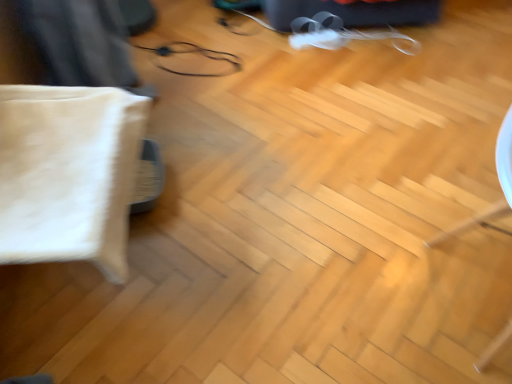
What is the approximate height of metallic wire at center?

2.73 inches.

The height and width of the screenshot is (384, 512). Describe the element at coordinates (192, 53) in the screenshot. I see `metallic wire at center` at that location.

Measure the distance between metallic wire at center and camera.

A distance of 1.91 meters exists between metallic wire at center and camera.

The height and width of the screenshot is (384, 512). I want to click on metallic wire at center, so click(x=192, y=53).

In order to click on white fabric pillow at left in this screenshot , I will do `click(68, 174)`.

Describe the element at coordinates (68, 174) in the screenshot. I see `white fabric pillow at left` at that location.

Find the location of `metallic wire at center`. metallic wire at center is located at coordinates (192, 53).

Can you confirm if metallic wire at center is positioned to the right of white fabric pillow at left?

Indeed, metallic wire at center is positioned on the right side of white fabric pillow at left.

Considering their positions, is metallic wire at center located in front of or behind white fabric pillow at left?

Visually, metallic wire at center is located behind white fabric pillow at left.

Does point (153, 51) come in front of point (16, 127)?

No, it is not.

From the image's perspective, which object appears higher, metallic wire at center or white fabric pillow at left?

metallic wire at center is shown above in the image.

Consider the image. From a real-world perspective, is metallic wire at center on top of white fabric pillow at left?

No, from a real-world perspective, metallic wire at center is not over white fabric pillow at left

In terms of width, does metallic wire at center look wider or thinner when compared to white fabric pillow at left?

Clearly, metallic wire at center has more width compared to white fabric pillow at left.

From the picture: Considering the sizes of metallic wire at center and white fabric pillow at left in the image, is metallic wire at center taller or shorter than white fabric pillow at left?

In the image, metallic wire at center appears to be shorter than white fabric pillow at left.

Who is bigger, metallic wire at center or white fabric pillow at left?

white fabric pillow at left.

Is metallic wire at center positioned beyond the bounds of white fabric pillow at left?

Yes, metallic wire at center is outside of white fabric pillow at left.

From the picture: Is metallic wire at center directly adjacent to white fabric pillow at left?

No, metallic wire at center is not touching white fabric pillow at left.

Is metallic wire at center oriented towards white fabric pillow at left?

No, metallic wire at center is not facing towards white fabric pillow at left.

The height and width of the screenshot is (384, 512). In the image, there is a white fabric pillow at left. What are the coordinates of `glasses above it (from the image's perspective)` in the screenshot? It's located at (192, 53).

In the image, is white fabric pillow at left on the left side or the right side of metallic wire at center?

white fabric pillow at left is to the left of metallic wire at center.

Is white fabric pillow at left in front of or behind metallic wire at center in the image?

white fabric pillow at left is in front of metallic wire at center.

Does point (84, 117) appear closer or farther from the camera than point (183, 53)?

Point (84, 117) appears to be closer to the viewer than point (183, 53).

From the image's perspective, would you say white fabric pillow at left is shown under metallic wire at center?

Yes, from the image's perspective, white fabric pillow at left is beneath metallic wire at center.

From a real-world perspective, between white fabric pillow at left and metallic wire at center, who is vertically lower?

In real-world perspective, metallic wire at center is lower.

Considering the relative sizes of white fabric pillow at left and metallic wire at center in the image provided, is white fabric pillow at left wider than metallic wire at center?

Incorrect, the width of white fabric pillow at left does not surpass that of metallic wire at center.

Who is taller, white fabric pillow at left or metallic wire at center?

white fabric pillow at left.

Can you confirm if white fabric pillow at left is bigger than metallic wire at center?

Yes.

Is white fabric pillow at left outside of metallic wire at center?

Yes, white fabric pillow at left is located beyond the bounds of metallic wire at center.

Is white fabric pillow at left not near metallic wire at center?

white fabric pillow at left is far away from metallic wire at center.

Is white fabric pillow at left facing towards metallic wire at center?

No, white fabric pillow at left is not facing towards metallic wire at center.

How many degrees apart are the facing directions of white fabric pillow at left and metallic wire at center?

The facing directions of white fabric pillow at left and metallic wire at center are 0.00041 degrees apart.

Locate an element on the screen. This screenshot has height=384, width=512. pillow above the metallic wire at center (from a real-world perspective) is located at coordinates (68, 174).

The height and width of the screenshot is (384, 512). Find the location of `glasses that is on the right side of white fabric pillow at left`. glasses that is on the right side of white fabric pillow at left is located at coordinates (192, 53).

Identify the location of glasses below the white fabric pillow at left (from a real-world perspective). The image size is (512, 384). (192, 53).